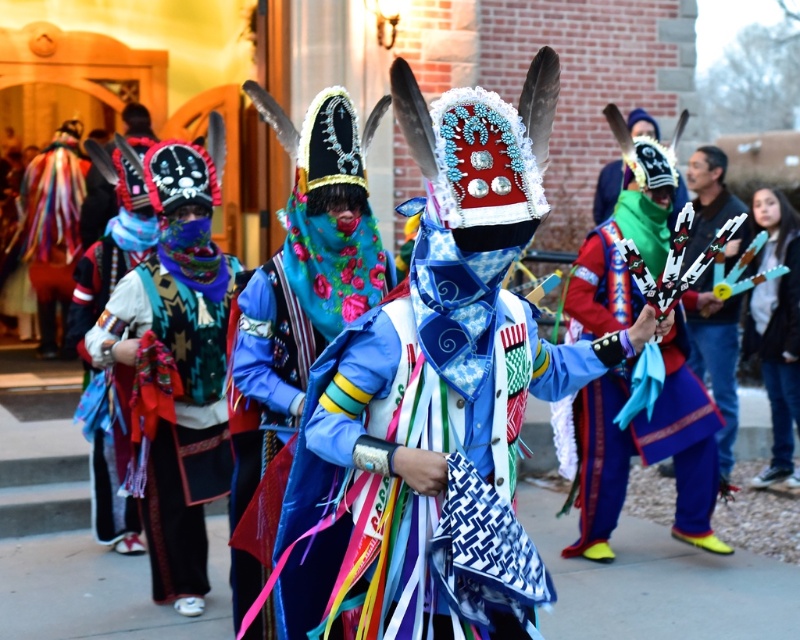
Question: Does blue woven fabric headdress at center appear over blue denim jeans at right?

Choices:
 (A) no
 (B) yes

Answer: (A)

Question: Does blue woven fabric headdress at center have a smaller size compared to denim jacket at lower right?

Choices:
 (A) no
 (B) yes

Answer: (A)

Question: Which is farther from the matte black mask at center?

Choices:
 (A) blue denim jeans at right
 (B) denim jacket at lower right
 (C) blue woven fabric headdress at center
 (D) blue satin headdress at center

Answer: (B)

Question: Considering the real-world distances, which object is closest to the blue denim jeans at right?

Choices:
 (A) denim jacket at lower right
 (B) blue woven fabric headdress at center
 (C) matte black mask at center
 (D) blue satin headdress at center

Answer: (A)

Question: Which object is positioned farthest from the blue woven fabric headdress at center?

Choices:
 (A) matte black mask at center
 (B) denim jacket at lower right
 (C) blue denim jeans at right

Answer: (A)

Question: Is matte black mask at center behind blue woven fabric headdress at center?

Choices:
 (A) yes
 (B) no

Answer: (B)